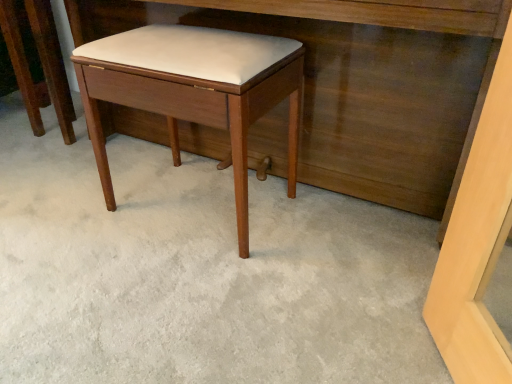
I want to click on vacant area that lies in front of matte wood stool at center, so click(180, 292).